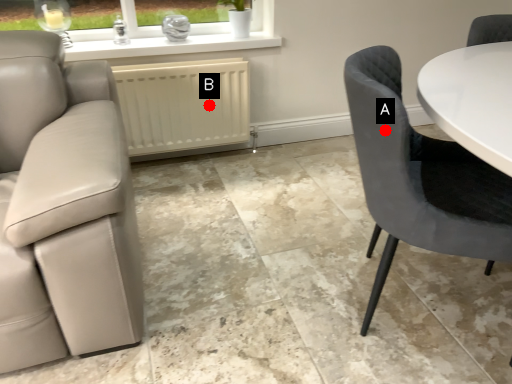
Question: Two points are circled on the image, labeled by A and B beside each circle. Which point appears farthest from the camera in this image?

Choices:
 (A) A is further
 (B) B is further

Answer: (B)